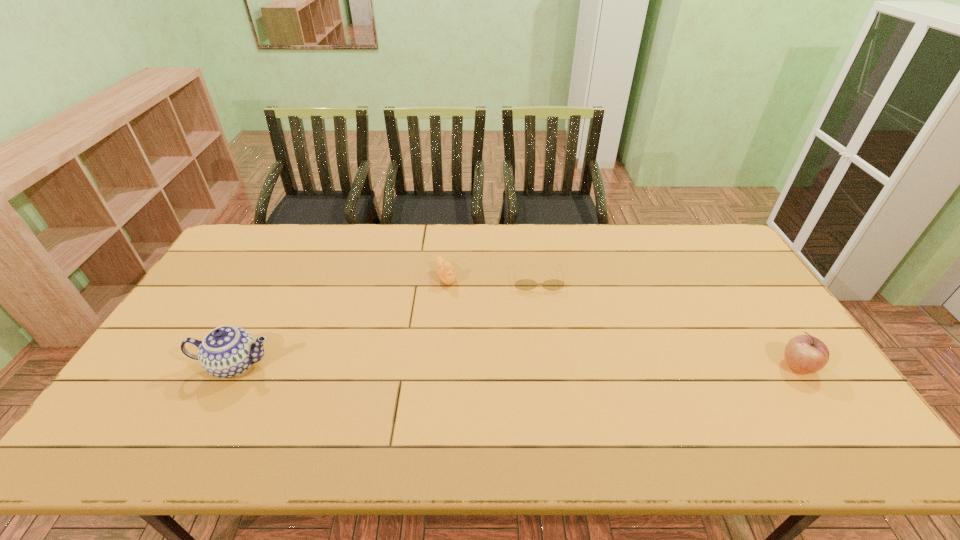
You are a GUI agent. You are given a task and a screenshot of the screen. Output one action in this format:
    pyautogui.click(x=<x>, y=<y>)
    Task: Click on the chinaware
    This screenshot has width=960, height=540.
    Given the screenshot: What is the action you would take?
    pyautogui.click(x=227, y=351)

Find the location of a particular element. The width and height of the screenshot is (960, 540). the tallest object is located at coordinates (227, 351).

What are the coordinates of `apple` in the screenshot? It's located at (807, 354).

At what (x,y) coordinates should I click in order to perform the action: click on the rightmost object. Please return your answer as a coordinate pair (x, y). Looking at the image, I should click on (807, 354).

You are a GUI agent. You are given a task and a screenshot of the screen. Output one action in this format:
    pyautogui.click(x=<x>, y=<y>)
    Task: Click on the duckling
    The image size is (960, 540).
    Given the screenshot: What is the action you would take?
    pyautogui.click(x=446, y=273)

Find the location of a particular element. This screenshot has height=540, width=960. the second object from left to right is located at coordinates (446, 273).

Find the location of a particular element. the shortest object is located at coordinates (526, 284).

This screenshot has width=960, height=540. Find the location of `sunglasses`. sunglasses is located at coordinates (526, 284).

What are the coordinates of `vacant region located 0.170m on the back of the rightmost object` in the screenshot? It's located at (759, 308).

This screenshot has height=540, width=960. I want to click on free spot located on the face of the second shortest object, so click(x=484, y=344).